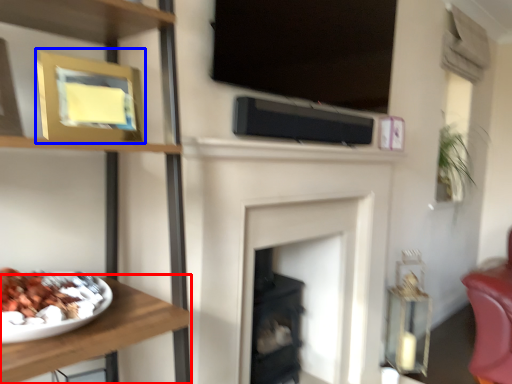
Question: Among these objects, which one is nearest to the camera, furniture (highlighted by a red box) or picture frame (highlighted by a blue box)?

Choices:
 (A) furniture
 (B) picture frame

Answer: (A)